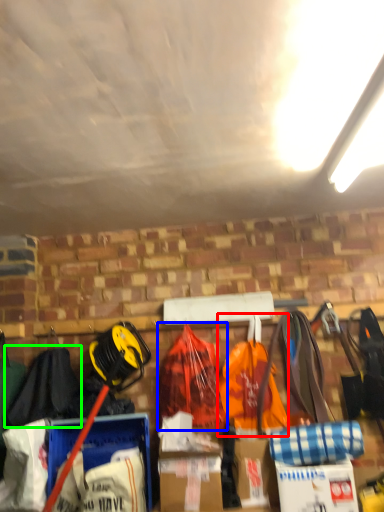
Question: Estimate the real-world distances between objects in this image. Which object is closer to grocery bag (highlighted by a red box), backpack (highlighted by a blue box) or clothing (highlighted by a green box)?

Choices:
 (A) backpack
 (B) clothing

Answer: (A)